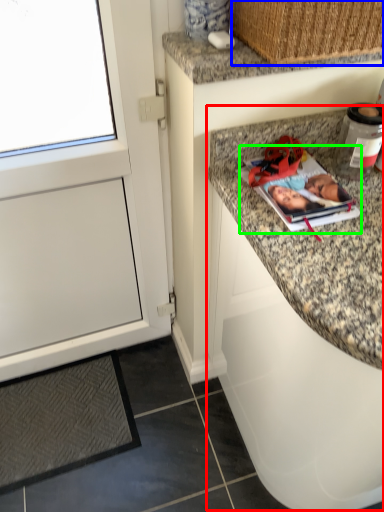
Question: Based on their relative distances, which object is nearer to cabinetry (highlighted by a red box)? Choose from basket (highlighted by a blue box) and magazine (highlighted by a green box).

Choices:
 (A) basket
 (B) magazine

Answer: (B)